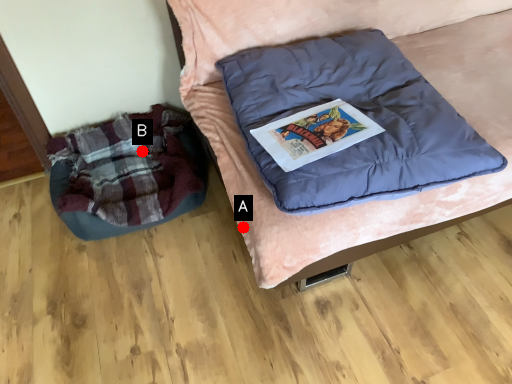
Question: Two points are circled on the image, labeled by A and B beside each circle. Which of the following is the closest to the observer?

Choices:
 (A) A is closer
 (B) B is closer

Answer: (A)